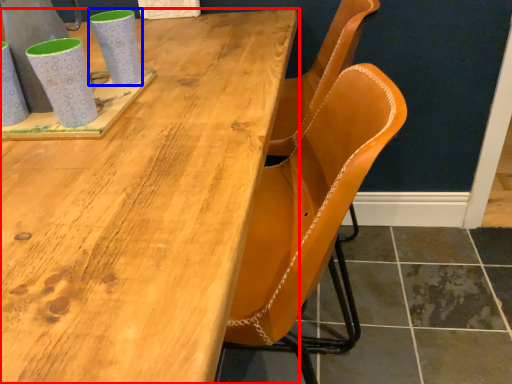
Question: Among these objects, which one is farthest to the camera, table (highlighted by a red box) or mug (highlighted by a blue box)?

Choices:
 (A) table
 (B) mug

Answer: (B)